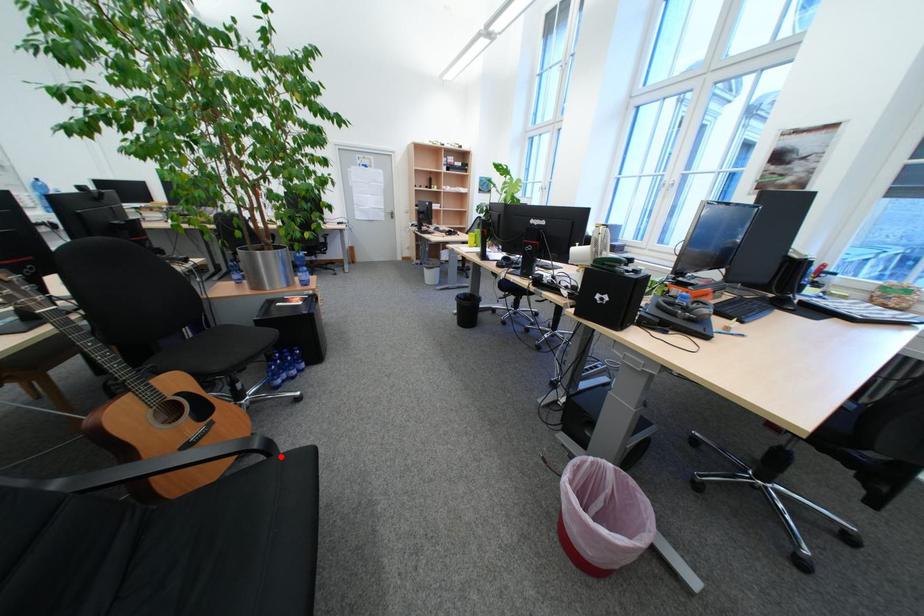
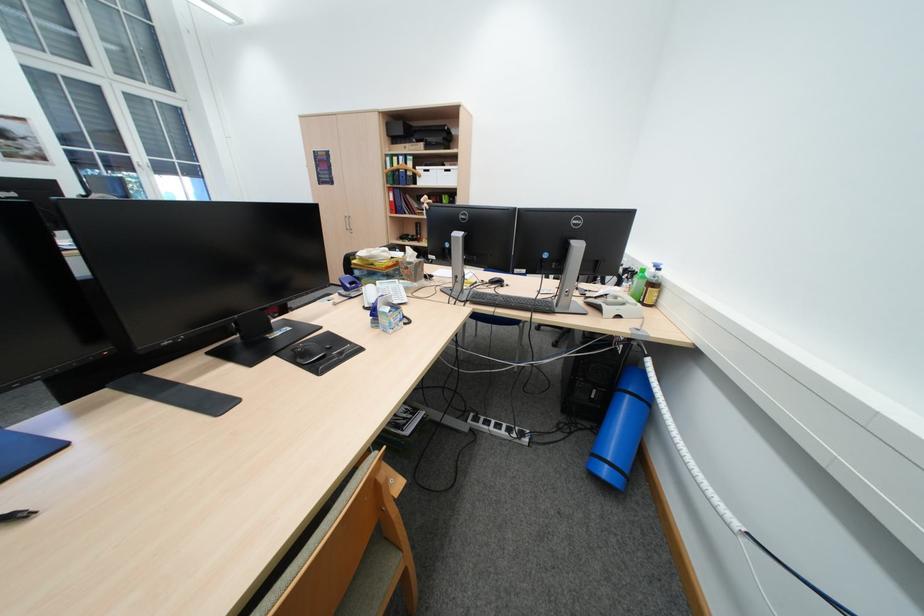
Question: I am providing you with two images of the same scene from different viewpoints. A red point is marked on the first image. Can you still see the location of the red point in image 2?

Choices:
 (A) Yes
 (B) No

Answer: (B)